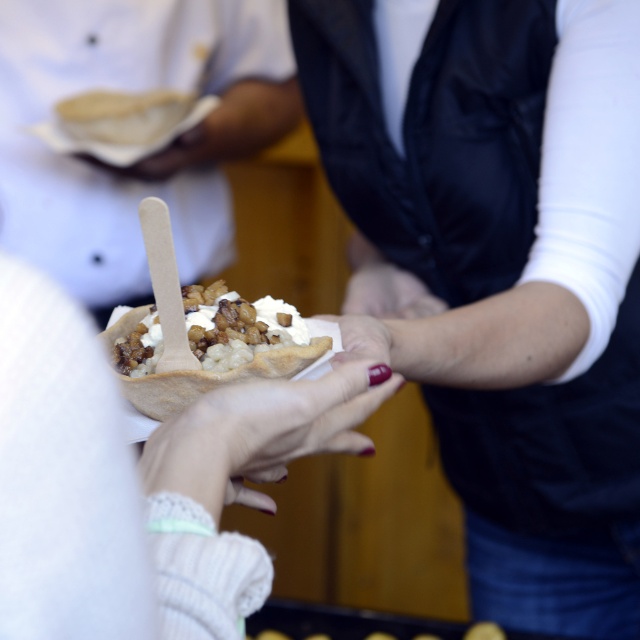
Who is positioned more to the left, matte white bowl at center or smooth skin hand at center?

From the viewer's perspective, matte white bowl at center appears more on the left side.

What do you see at coordinates (144, 160) in the screenshot? Image resolution: width=640 pixels, height=640 pixels. I see `matte white bowl at center` at bounding box center [144, 160].

Image resolution: width=640 pixels, height=640 pixels. Identify the location of matte white bowl at center. (144, 160).

Is point (176, 237) positioned behind point (248, 403)?

Yes, it is.

I want to click on matte white bowl at center, so click(144, 160).

You are a GUI agent. You are given a task and a screenshot of the screen. Output one action in this format:
    pyautogui.click(x=<x>, y=<y>)
    Task: Click on the matte white bowl at center
    The width and height of the screenshot is (640, 640).
    Given the screenshot: What is the action you would take?
    pyautogui.click(x=144, y=160)

Does white fabric hand at center lie behind smooth skin hand at center?

No, white fabric hand at center is in front of smooth skin hand at center.

Where is `white fabric hand at center`? The width and height of the screenshot is (640, 640). white fabric hand at center is located at coordinates (260, 433).

Between point (170, 422) and point (349, 296), which one is positioned in front?

Positioned in front is point (170, 422).

You are a GUI agent. You are given a task and a screenshot of the screen. Output one action in this format:
    pyautogui.click(x=<x>, y=<y>)
    Task: Click on the white fabric hand at center
    This screenshot has height=640, width=640.
    Given the screenshot: What is the action you would take?
    pyautogui.click(x=260, y=433)